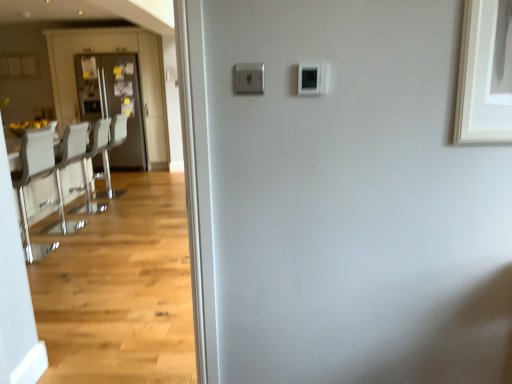
Question: Should I look upward or downward to see white plastic thermostat at upper center?

Choices:
 (A) up
 (B) down

Answer: (A)

Question: Is white leather chairs at left turned away from white glossy armchair at left, placed as the 1th armchair when sorted from front to back?

Choices:
 (A) no
 (B) yes

Answer: (A)

Question: Does white leather chairs at left come in front of white glossy armchair at left, positioned as the second armchair in back-to-front order?

Choices:
 (A) no
 (B) yes

Answer: (B)

Question: From the image's perspective, is white leather chairs at left on top of white glossy armchair at left, placed as the 1th armchair when sorted from front to back?

Choices:
 (A) no
 (B) yes

Answer: (A)

Question: From the image's perspective, is white leather chairs at left under white glossy armchair at left, positioned as the second armchair in back-to-front order?

Choices:
 (A) no
 (B) yes

Answer: (B)

Question: Is white leather chairs at left oriented towards white glossy armchair at left, positioned as the second armchair in back-to-front order?

Choices:
 (A) no
 (B) yes

Answer: (A)

Question: Is white leather chairs at left positioned beyond the bounds of white glossy armchair at left, placed as the 1th armchair when sorted from front to back?

Choices:
 (A) no
 (B) yes

Answer: (B)

Question: Does matte black refrigerator at left have a greater width compared to white glossy chair at left?

Choices:
 (A) yes
 (B) no

Answer: (A)

Question: Can you confirm if matte black refrigerator at left is shorter than white glossy chair at left?

Choices:
 (A) yes
 (B) no

Answer: (B)

Question: Is matte black refrigerator at left facing away from white glossy chair at left?

Choices:
 (A) yes
 (B) no

Answer: (B)

Question: Is matte black refrigerator at left oriented towards white glossy chair at left?

Choices:
 (A) yes
 (B) no

Answer: (A)

Question: From a real-world perspective, is matte black refrigerator at left located higher than white glossy chair at left?

Choices:
 (A) yes
 (B) no

Answer: (A)

Question: Is matte black refrigerator at left not within white glossy chair at left?

Choices:
 (A) yes
 (B) no

Answer: (A)

Question: Considering the relative positions of white leather chairs at left and white glossy chair at left in the image provided, is white leather chairs at left behind white glossy chair at left?

Choices:
 (A) yes
 (B) no

Answer: (A)